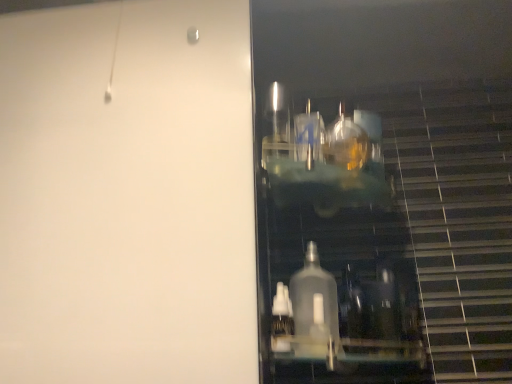
Question: From the image's perspective, is transparent plastic bottles at right positioned above or below clear plastic bottle at lower center?

Choices:
 (A) above
 (B) below

Answer: (A)

Question: From a real-world perspective, is transparent plastic bottles at right physically located above or below clear plastic bottle at lower center?

Choices:
 (A) above
 (B) below

Answer: (A)

Question: Which of these objects is positioned closest to the transparent plastic bottles at right?

Choices:
 (A) clear plastic bottle at lower center
 (B) transparent glass door at right

Answer: (A)

Question: Which of these objects is positioned farthest from the clear plastic bottle at lower center?

Choices:
 (A) transparent glass door at right
 (B) transparent plastic bottles at right

Answer: (A)